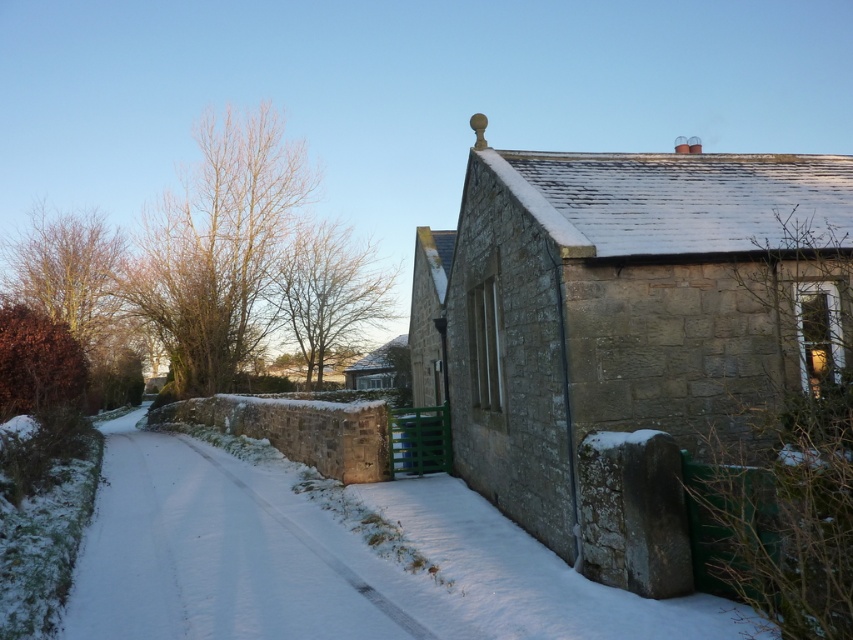
Which is more to the right, stone house at right or white snow-covered path at center?

stone house at right

Can you confirm if stone house at right is positioned above white snow-covered path at center?

Yes.

Is point (663, 413) less distant than point (360, 600)?

No.

This screenshot has height=640, width=853. I want to click on stone house at right, so click(625, 310).

Does white snow-covered path at center appear on the right side of matte stone hut at center?

In fact, white snow-covered path at center is to the left of matte stone hut at center.

Does point (265, 547) lie behind point (393, 385)?

No, (265, 547) is closer to viewer.

Is point (364, 636) positioned after point (381, 376)?

That is False.

You are a GUI agent. You are given a task and a screenshot of the screen. Output one action in this format:
    pyautogui.click(x=<x>, y=<y>)
    Task: Click on the white snow-covered path at center
    Image resolution: width=853 pixels, height=640 pixels.
    Given the screenshot: What is the action you would take?
    pyautogui.click(x=212, y=554)

Is point (537, 538) closer to viewer compared to point (354, 385)?

Yes, it is in front of point (354, 385).

Locate an element on the screen. stone house at right is located at coordinates (625, 310).